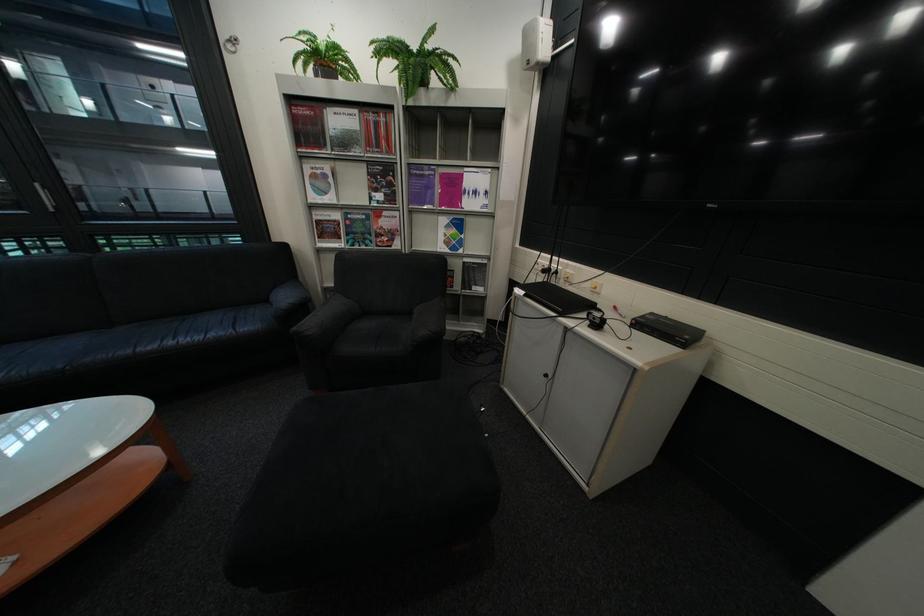
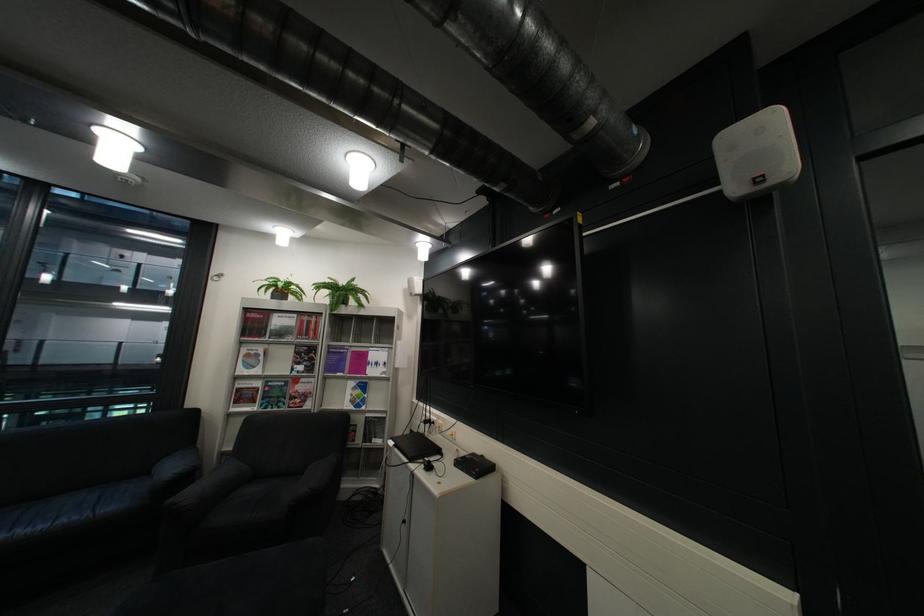
Find the pixel in the second image that matches (x=493, y=290) in the first image.

(393, 442)